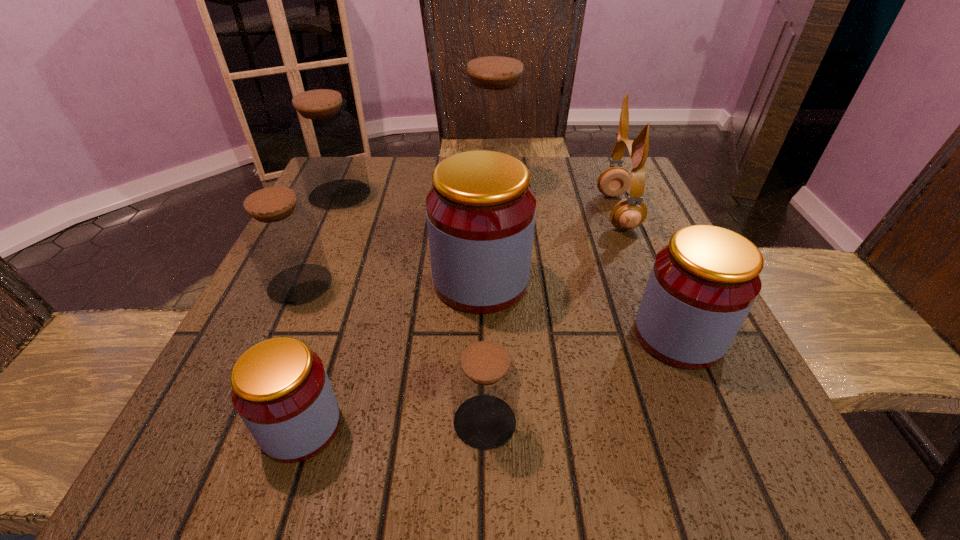
Identify the location of free location at the far right corner. Image resolution: width=960 pixels, height=540 pixels. (651, 204).

Image resolution: width=960 pixels, height=540 pixels. Find the location of `vacant space at the near right corner of the desktop`. vacant space at the near right corner of the desktop is located at coordinates (712, 472).

Image resolution: width=960 pixels, height=540 pixels. What are the coordinates of `vacant area that lies between the second red jar from left to right and the third smallest brown jar` in the screenshot? It's located at (410, 238).

At what (x,y) coordinates should I click in order to perform the action: click on vacant area that lies between the nearest brown jar and the third smallest brown jar. Please return your answer as a coordinate pair (x, y). Looking at the image, I should click on (412, 308).

Locate an element on the screen. The width and height of the screenshot is (960, 540). vacant space in between the third smallest brown jar and the smallest red jar is located at coordinates tap(321, 310).

At what (x,y) coordinates should I click in order to perform the action: click on vacant region between the leftmost red jar and the nearest brown jar. Please return your answer as a coordinate pair (x, y). The height and width of the screenshot is (540, 960). Looking at the image, I should click on (393, 424).

Locate an element on the screen. The image size is (960, 540). free space between the second smallest red jar and the biggest red jar is located at coordinates (580, 308).

Image resolution: width=960 pixels, height=540 pixels. I want to click on vacant region between the earphone and the nearest brown jar, so click(x=551, y=317).

Where is `unoccupied area between the second nearest brown jar and the second red jar from right to left`? The width and height of the screenshot is (960, 540). unoccupied area between the second nearest brown jar and the second red jar from right to left is located at coordinates (391, 282).

Where is `the third closest object relative to the tallest jar`? The image size is (960, 540). the third closest object relative to the tallest jar is located at coordinates (326, 140).